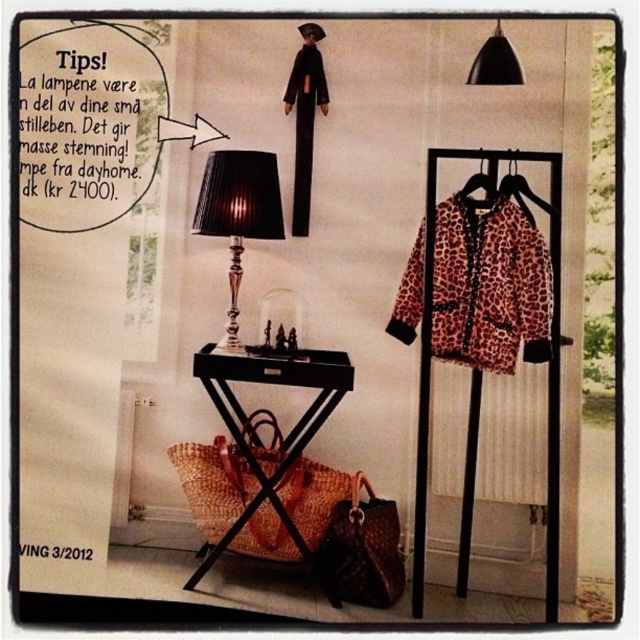
Is leopard print fabric jacket at right shorter than black matte pendant light at upper right?

In fact, leopard print fabric jacket at right may be taller than black matte pendant light at upper right.

Where is `leopard print fabric jacket at right`? The height and width of the screenshot is (640, 640). leopard print fabric jacket at right is located at coordinates (490, 285).

Can you confirm if leopard print fabric jacket at right is positioned below leopard print fabric hanger at upper right?

Yes, leopard print fabric jacket at right is below leopard print fabric hanger at upper right.

Does leopard print fabric jacket at right have a greater height compared to leopard print fabric hanger at upper right?

Yes.

This screenshot has width=640, height=640. In order to click on leopard print fabric jacket at right in this screenshot , I will do `click(490, 285)`.

You are a GUI agent. You are given a task and a screenshot of the screen. Output one action in this format:
    pyautogui.click(x=<x>, y=<y>)
    Task: Click on the leopard print fabric jacket at right
    
    Given the screenshot: What is the action you would take?
    pyautogui.click(x=490, y=285)

Is shiny silver lamp at center thinner than leopard print fabric hanger at upper right?

Incorrect, shiny silver lamp at center's width is not less than leopard print fabric hanger at upper right's.

Image resolution: width=640 pixels, height=640 pixels. Identify the location of shiny silver lamp at center. (237, 214).

The height and width of the screenshot is (640, 640). Find the location of `shiny silver lamp at center`. shiny silver lamp at center is located at coordinates (237, 214).

Locate an element on the screen. shiny silver lamp at center is located at coordinates (237, 214).